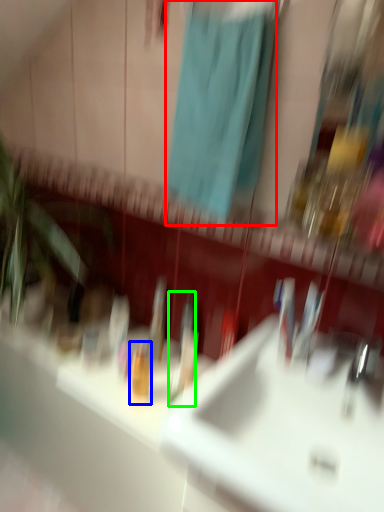
Question: Considering the real-world distances, which object is closest to shower curtain (highlighted by a red box)? toiletry (highlighted by a blue box) or toothbrush (highlighted by a green box).

Choices:
 (A) toiletry
 (B) toothbrush

Answer: (B)